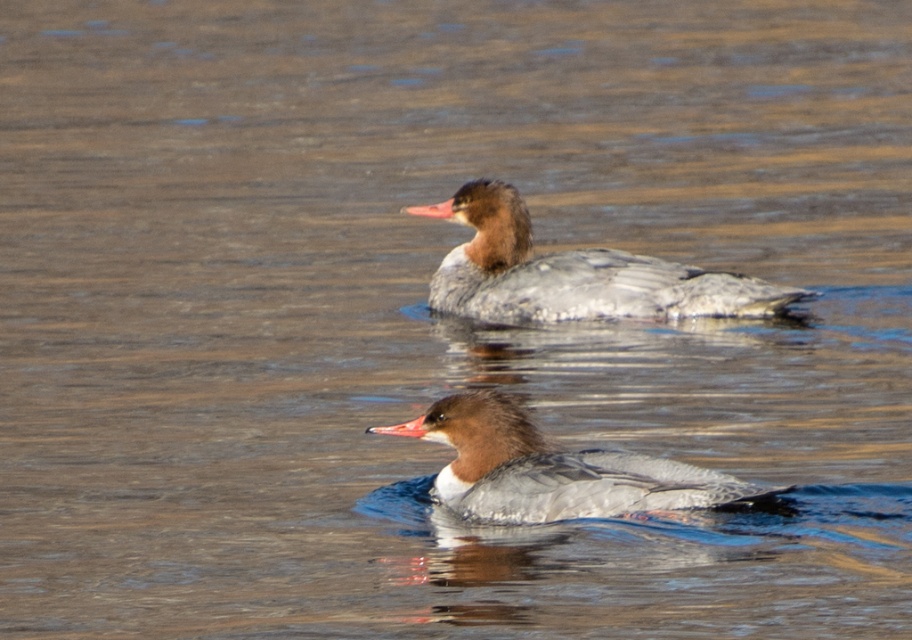
You are a photographer trying to capture both ducks in a single shot. The scene has a brown speckled duck at center represented by point (x=573, y=273) and another duck somewhere in the water. Where should you position your camera to ensure both ducks are in frame?

The brown speckled duck at center is represented by point (x=573, y=273), so positioning the camera to include this point and the area around it will ensure both ducks are captured in the shot.